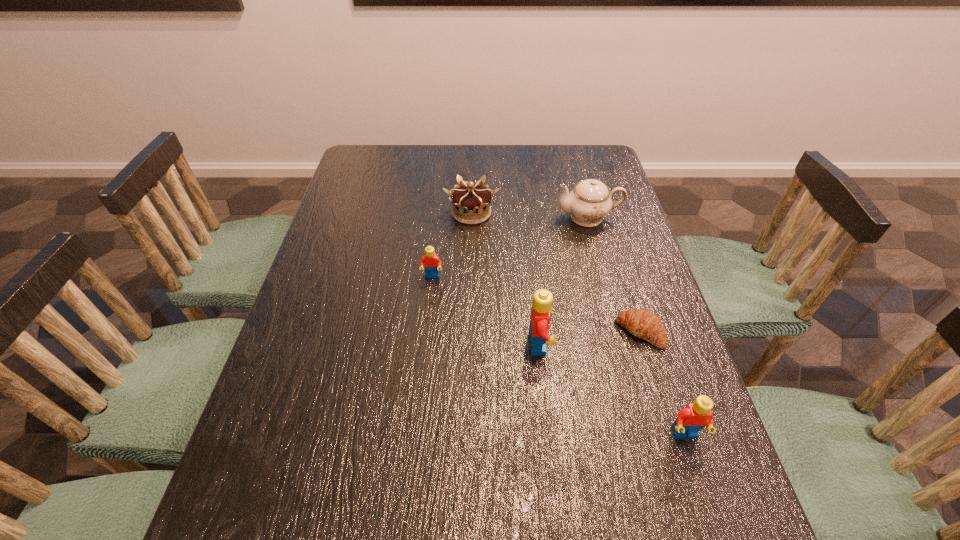
Find the location of a particular element. Image resolution: width=960 pixels, height=540 pixels. vacant space situated 0.240m on the face of the third object from left to right is located at coordinates (658, 344).

Identify the location of free space located 0.340m on the left of the crown. The width and height of the screenshot is (960, 540). (332, 213).

Locate an element on the screen. The height and width of the screenshot is (540, 960). vacant space situated on the front of the shortest object is located at coordinates (676, 447).

At what (x,y) coordinates should I click in order to perform the action: click on vacant space located 0.360m at the spout of the chinaware. Please return your answer as a coordinate pair (x, y). The width and height of the screenshot is (960, 540). Looking at the image, I should click on (436, 217).

Identify the location of vacant space located at the spout of the chinaware. This screenshot has width=960, height=540. (539, 217).

The image size is (960, 540). In order to click on free region located 0.120m at the spout of the chinaware in this screenshot , I will do click(x=516, y=217).

Where is `object that is at the near edge`? object that is at the near edge is located at coordinates (693, 417).

At what (x,y) coordinates should I click in order to perform the action: click on Lego at the right edge. Please return your answer as a coordinate pair (x, y). The image size is (960, 540). Looking at the image, I should click on (693, 417).

At what (x,y) coordinates should I click in order to perform the action: click on crescent roll positioned at the right edge. Please return your answer as a coordinate pair (x, y). This screenshot has height=540, width=960. Looking at the image, I should click on (644, 324).

Find the location of a particular element. The height and width of the screenshot is (540, 960). chinaware at the right edge is located at coordinates (590, 201).